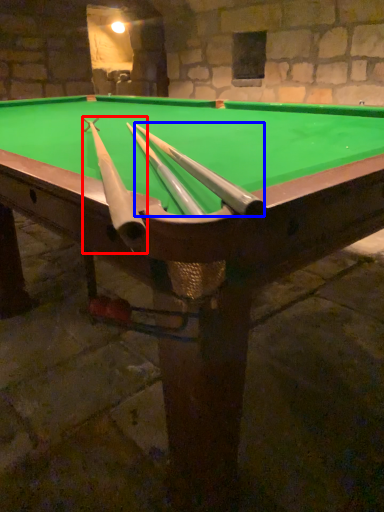
Question: Which object appears closest to the camera in this image, cue (highlighted by a red box) or cue (highlighted by a blue box)?

Choices:
 (A) cue
 (B) cue

Answer: (A)